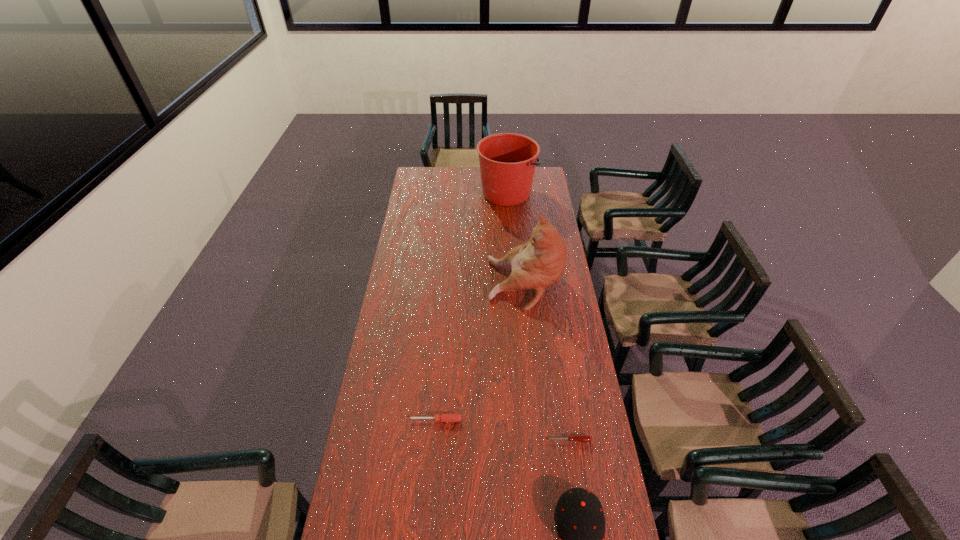
Identify the location of unoccupied position between the fourth farthest object and the farthest object. (538, 316).

The image size is (960, 540). Find the location of `free space between the bucket and the cat`. free space between the bucket and the cat is located at coordinates (516, 238).

Locate which object is the fourth closest to the farthest object. Please provide its 2D coordinates. Your answer should be formatted as a tuple, i.e. [(x, y)], where the tuple contains the x and y coordinates of a point satisfying the conditions above.

[(579, 517)]

Image resolution: width=960 pixels, height=540 pixels. In order to click on object that can be found as the fourth closest to the cap in this screenshot , I will do `click(507, 161)`.

Locate an element on the screen. vacant space that satisfies the following two spatial constraints: 1. on the face of the fourth nearest object; 2. on the left side of the nearer screwdriver is located at coordinates (541, 440).

You are a GUI agent. You are given a task and a screenshot of the screen. Output one action in this format:
    pyautogui.click(x=<x>, y=<y>)
    Task: Click on the vacant area that satisfies the following two spatial constraints: 1. on the front side of the left screwdriver; 2. on the right side of the right screwdriver
    
    Given the screenshot: What is the action you would take?
    pyautogui.click(x=434, y=440)

Where is `free space that satisfies the following two spatial constraints: 1. on the face of the second farthest object; 2. on the front side of the third farthest object`? free space that satisfies the following two spatial constraints: 1. on the face of the second farthest object; 2. on the front side of the third farthest object is located at coordinates (540, 420).

Find the location of a particular element. This screenshot has height=540, width=960. vacant space that satisfies the following two spatial constraints: 1. on the front side of the right screwdriver; 2. on the right side of the left screwdriver is located at coordinates (434, 440).

I want to click on vacant point that satisfies the following two spatial constraints: 1. on the face of the cat; 2. on the back side of the second nearest object, so click(541, 440).

This screenshot has height=540, width=960. Identify the location of vacant space that satisfies the following two spatial constraints: 1. on the face of the cat; 2. on the left side of the right screwdriver. tap(541, 440).